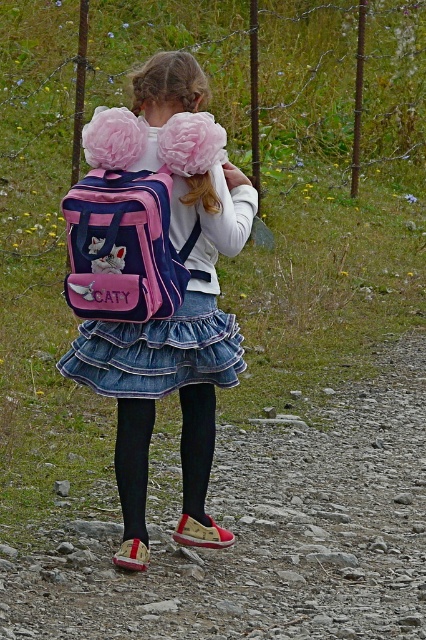
Question: Can you confirm if pink fabric backpack at center is positioned to the left of denim skirt at center?

Choices:
 (A) yes
 (B) no

Answer: (A)

Question: Based on their relative distances, which object is farther from the pink fabric backpack at back?

Choices:
 (A) pink fabric backpack at center
 (B) denim skirt at center
 (C) black tights at center
 (D) rough gravel path at center

Answer: (D)

Question: Which object is farther from the camera taking this photo?

Choices:
 (A) pink fabric backpack at back
 (B) rough gravel path at center
 (C) denim skirt at center

Answer: (C)

Question: Which object is positioned closest to the rough gravel path at center?

Choices:
 (A) pink fabric backpack at back
 (B) pink fabric backpack at center
 (C) denim skirt at center

Answer: (B)

Question: Is rough gravel path at center wider than pink fabric backpack at center?

Choices:
 (A) yes
 (B) no

Answer: (A)

Question: Can you confirm if denim skirt at center is smaller than pink fabric backpack at back?

Choices:
 (A) no
 (B) yes

Answer: (A)